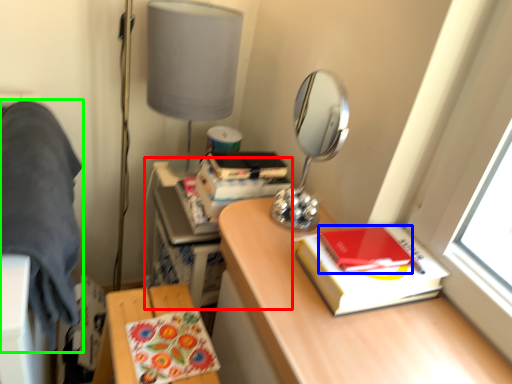
Question: Which object is positioned closest to computer desk (highlighted by a red box)? Select from notebook (highlighted by a blue box) and bedding (highlighted by a green box).

Choices:
 (A) notebook
 (B) bedding

Answer: (B)